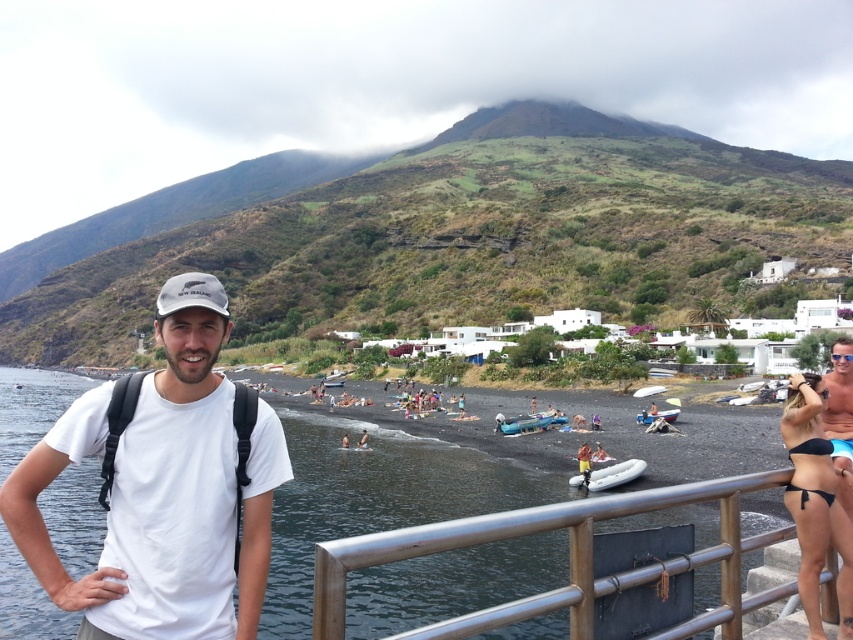
Does white cotton t-shirt at left have a greater width compared to inflatable blue boat at center?

Yes, white cotton t-shirt at left is wider than inflatable blue boat at center.

Is white cotton t-shirt at left thinner than inflatable blue boat at center?

No.

Is point (56, 433) farther from camera compared to point (518, 429)?

No, (56, 433) is in front of (518, 429).

Image resolution: width=853 pixels, height=640 pixels. I want to click on white cotton t-shirt at left, so click(x=163, y=490).

Who is higher up, inflatable blue boat at center or white plastic boat at center?

Positioned higher is white plastic boat at center.

Can you confirm if inflatable blue boat at center is smaller than white plastic boat at center?

No, inflatable blue boat at center is not smaller than white plastic boat at center.

Who is more forward, (547,422) or (659,413)?

Positioned in front is point (659,413).

Identify the location of inflatable blue boat at center. This screenshot has width=853, height=640. (531, 422).

Who is taller, silver metallic railing at lower right or inflatable yellow at center?

silver metallic railing at lower right is taller.

Is point (412, 525) closer to viewer compared to point (602, 468)?

Yes, it is in front of point (602, 468).

Does point (572, 572) lie behind point (625, 468)?

No.

Where is `silver metallic railing at lower right`? Image resolution: width=853 pixels, height=640 pixels. silver metallic railing at lower right is located at coordinates (569, 556).